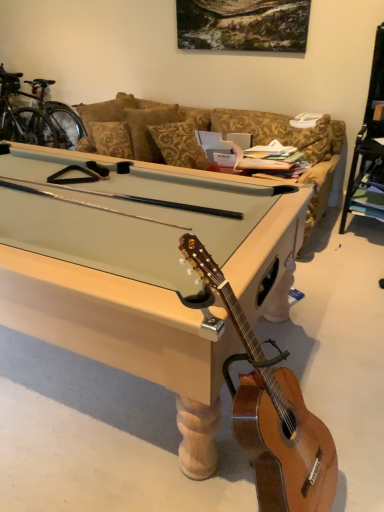
Question: Would you say light brown wood guitar at lower right is a long distance from shiny metallic bicycle at upper left?

Choices:
 (A) no
 (B) yes

Answer: (B)

Question: Is light brown wood guitar at lower right positioned before shiny metallic bicycle at upper left?

Choices:
 (A) yes
 (B) no

Answer: (A)

Question: From the image's perspective, does light brown wood guitar at lower right appear lower than shiny metallic bicycle at upper left?

Choices:
 (A) no
 (B) yes

Answer: (B)

Question: Does light brown wood guitar at lower right have a larger size compared to shiny metallic bicycle at upper left?

Choices:
 (A) yes
 (B) no

Answer: (B)

Question: From a real-world perspective, is light brown wood guitar at lower right on top of shiny metallic bicycle at upper left?

Choices:
 (A) yes
 (B) no

Answer: (B)

Question: Is light brown wood guitar at lower right aimed at shiny metallic bicycle at upper left?

Choices:
 (A) no
 (B) yes

Answer: (A)

Question: Considering the relative sizes of shiny metallic bicycle at upper left and light brown wood guitar at lower right in the image provided, is shiny metallic bicycle at upper left shorter than light brown wood guitar at lower right?

Choices:
 (A) no
 (B) yes

Answer: (A)

Question: Is shiny metallic bicycle at upper left smaller than light brown wood guitar at lower right?

Choices:
 (A) no
 (B) yes

Answer: (A)

Question: Considering the relative sizes of shiny metallic bicycle at upper left and light brown wood guitar at lower right in the image provided, is shiny metallic bicycle at upper left bigger than light brown wood guitar at lower right?

Choices:
 (A) yes
 (B) no

Answer: (A)

Question: From the image's perspective, would you say shiny metallic bicycle at upper left is shown under light brown wood guitar at lower right?

Choices:
 (A) no
 (B) yes

Answer: (A)

Question: Is shiny metallic bicycle at upper left turned away from light brown wood guitar at lower right?

Choices:
 (A) yes
 (B) no

Answer: (B)

Question: Is shiny metallic bicycle at upper left positioned beyond the bounds of light brown wood guitar at lower right?

Choices:
 (A) yes
 (B) no

Answer: (A)

Question: Does shiny metallic bicycle at upper left have a greater width compared to light wood pool table at center?

Choices:
 (A) yes
 (B) no

Answer: (B)